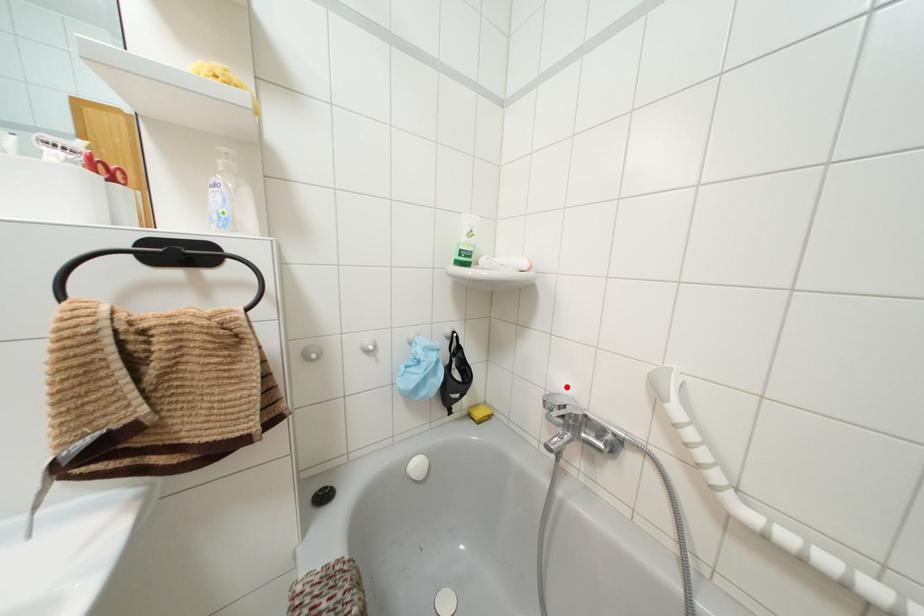
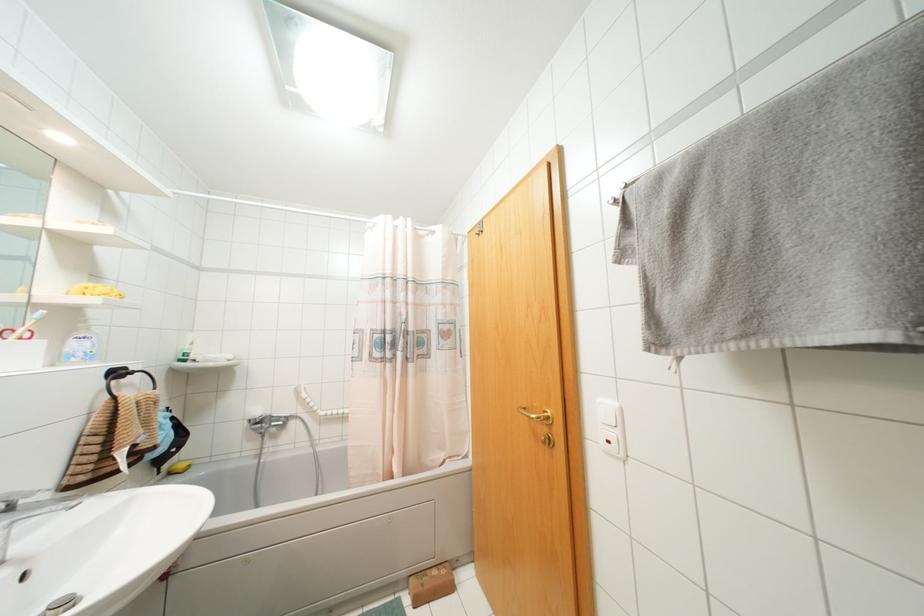
Question: A red point is marked in image1. In image2, is the corresponding 3D point closer to the camera or farther? Reply with the corresponding letter.

Choices:
 (A) The corresponding 3D point is closer.
 (B) The corresponding 3D point is farther.

Answer: (B)